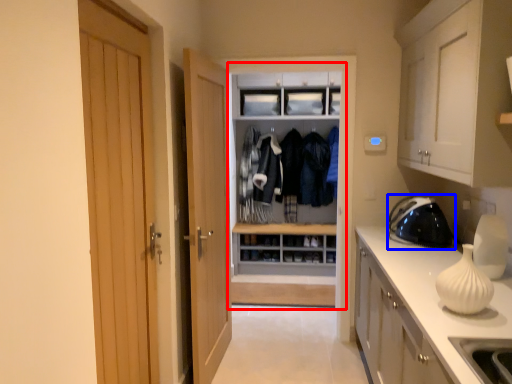
Question: Which object is further to the camera taking this photo, dresser (highlighted by a red box) or appliance (highlighted by a blue box)?

Choices:
 (A) dresser
 (B) appliance

Answer: (A)